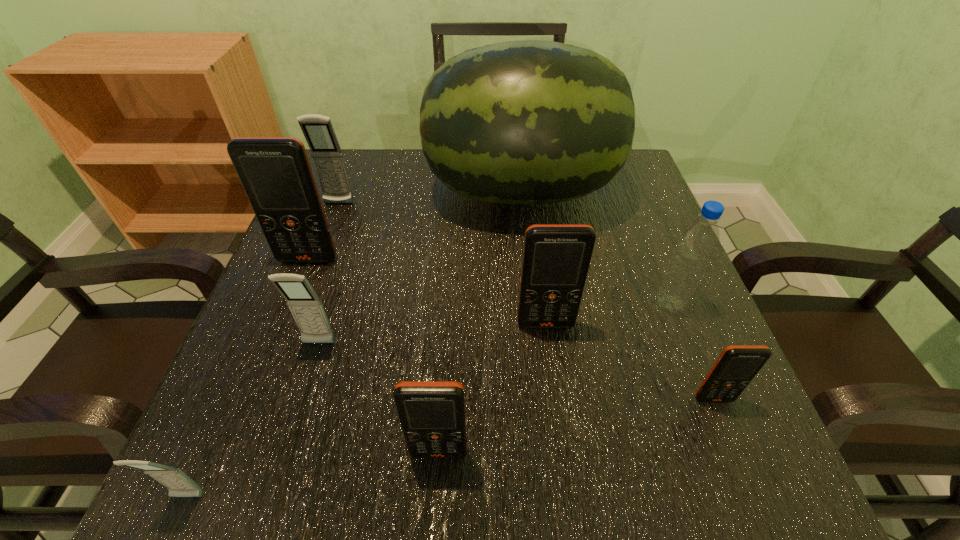
This screenshot has height=540, width=960. I want to click on the tallest object, so click(526, 122).

At what (x,y) coordinates should I click in order to perform the action: click on green watermelon. Please return your answer as a coordinate pair (x, y). Image resolution: width=960 pixels, height=540 pixels. Looking at the image, I should click on (526, 122).

At what (x,y) coordinates should I click in order to perform the action: click on the biggest orange cellular telephone. Please return your answer as a coordinate pair (x, y). This screenshot has width=960, height=540. Looking at the image, I should click on click(x=275, y=172).

Find the location of `the sixth nearest cellular telephone`. the sixth nearest cellular telephone is located at coordinates (275, 172).

Locate an element on the screen. the farthest gray cellular telephone is located at coordinates coord(318,131).

Identify the location of the biggest gray cellular telephone. The height and width of the screenshot is (540, 960). (318, 131).

Where is `the second biggest orange cellular telephone`? the second biggest orange cellular telephone is located at coordinates (556, 257).

Locate an element on the screen. the second farthest orange cellular telephone is located at coordinates (556, 257).

The width and height of the screenshot is (960, 540). I want to click on water bottle, so click(x=698, y=241).

What are the coordinates of `the second biggest gray cellular telephone` in the screenshot? It's located at (306, 307).